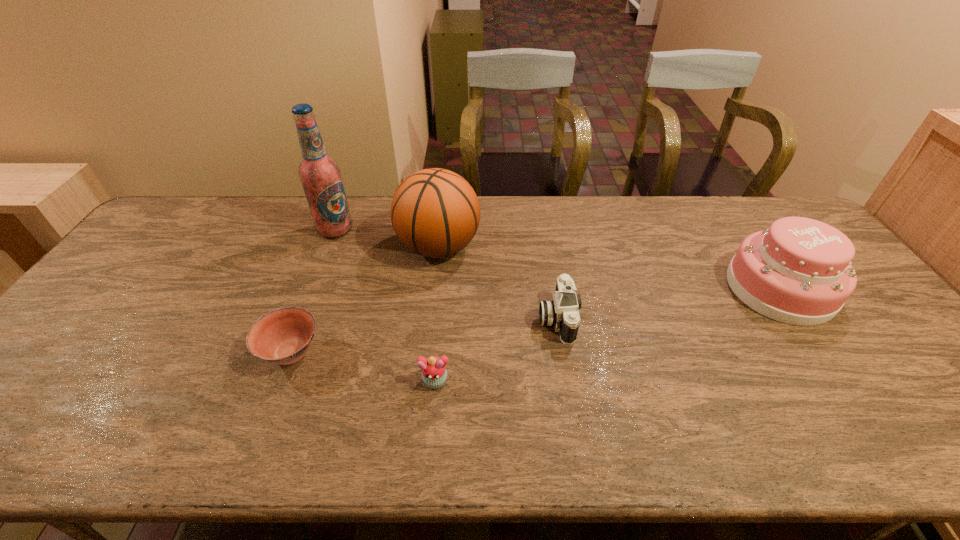
In the image, there is a desktop. At what (x,y) coordinates should I click in order to perform the action: click on free space at the far left corner. Please return your answer as a coordinate pair (x, y). The width and height of the screenshot is (960, 540). Looking at the image, I should click on (190, 234).

Image resolution: width=960 pixels, height=540 pixels. I want to click on free area in between the cupcake and the second tallest object, so click(437, 314).

I want to click on empty space between the tallest object and the basketball, so click(387, 238).

Locate an element on the screen. Image resolution: width=960 pixels, height=540 pixels. vacant space that's between the cupcake and the bowl is located at coordinates (363, 367).

Where is `unoccupied position between the bowl and the fifth shortest object`? unoccupied position between the bowl and the fifth shortest object is located at coordinates (365, 300).

This screenshot has width=960, height=540. Identify the location of empty location between the bowl and the cupcake. (363, 367).

Identify the location of free space between the tallest object and the bowl. (313, 291).

This screenshot has height=540, width=960. Identify the location of free space that is in between the alcohol and the bowl. pos(313,291).

Identify the location of vacant area that lies between the rightmost object and the third shortest object. (668, 303).

The height and width of the screenshot is (540, 960). What are the coordinates of `unoccupied position between the second tallest object and the bowl` in the screenshot? It's located at (365, 300).